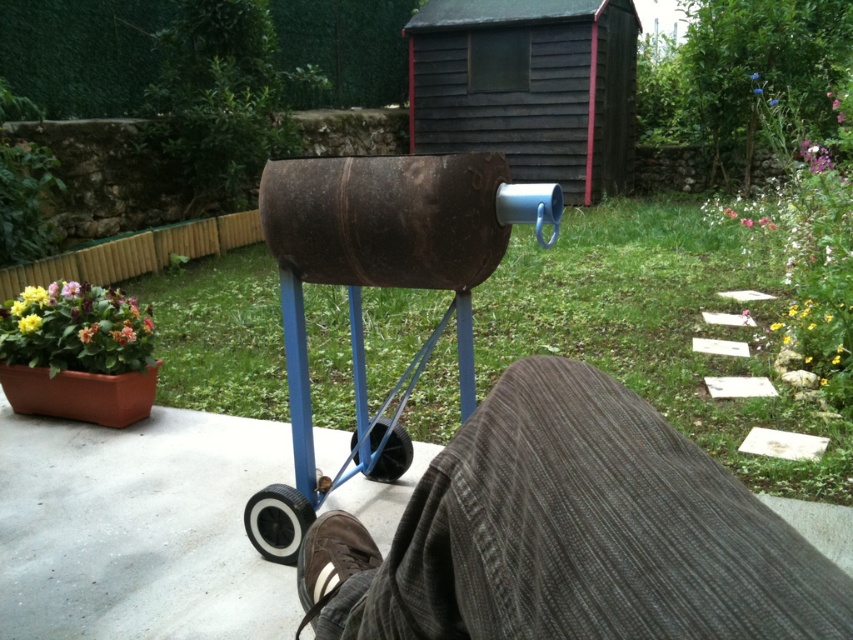
Question: Is the position of rustic wood shed at upper center less distant than that of black rubber wheel at lower left?

Choices:
 (A) yes
 (B) no

Answer: (B)

Question: Does brown corduroy pants at lower center appear on the right side of black rubber wheel at lower center?

Choices:
 (A) no
 (B) yes

Answer: (B)

Question: Is brown corduroy pants at lower center below rusty metal cart at center?

Choices:
 (A) no
 (B) yes

Answer: (B)

Question: Which of these objects is positioned farthest from the rustic wood shed at upper center?

Choices:
 (A) black rubber wheel at lower center
 (B) brown corduroy pants at lower center
 (C) black rubber wheel at lower left

Answer: (B)

Question: Based on their relative distances, which object is nearer to the black rubber wheel at lower center?

Choices:
 (A) rusty metal cart at center
 (B) brown corduroy pants at lower center

Answer: (A)

Question: Which point is closer to the camera?

Choices:
 (A) (375, 435)
 (B) (436, 97)
 (C) (252, 518)
 (D) (781, 579)

Answer: (D)